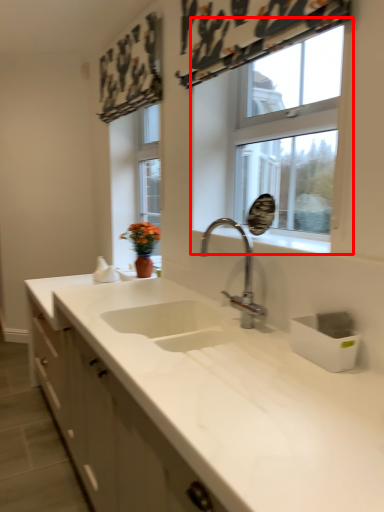
Question: Where is window (annotated by the red box) located in relation to tap in the image?

Choices:
 (A) left
 (B) right

Answer: (B)